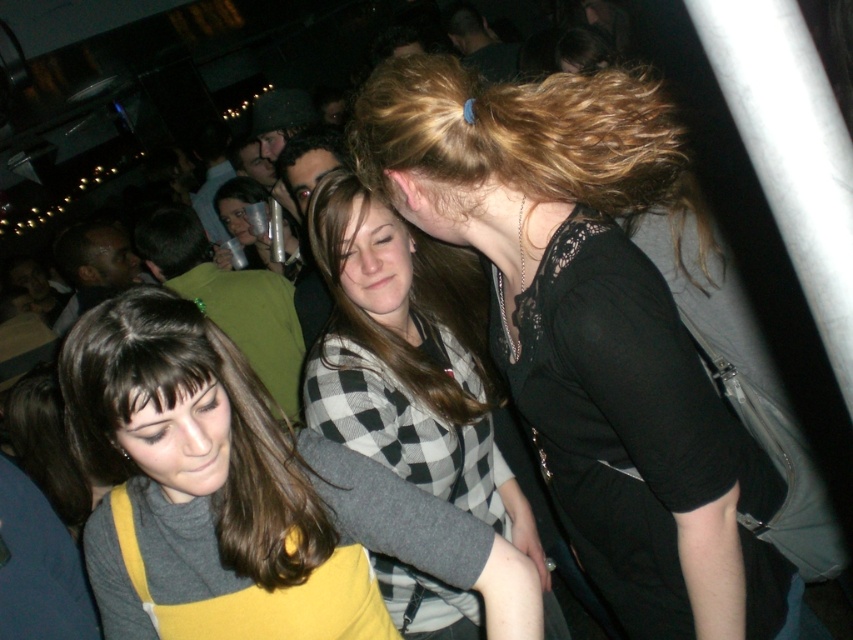
Question: Which point is closer to the camera?

Choices:
 (A) matte yellow dress at center
 (B) checkered fabric sweater at center
 (C) black lace dress at center
 (D) brownsmoothhair at center

Answer: (A)

Question: Estimate the real-world distances between objects in this image. Which object is closer to the matte yellow dress at center?

Choices:
 (A) black lace dress at center
 (B) brownsmoothhair at center
 (C) checkered fabric sweater at center

Answer: (A)

Question: Which object appears farthest from the camera in this image?

Choices:
 (A) black lace dress at center
 (B) checkered fabric sweater at center

Answer: (B)

Question: Is black lace dress at center above matte yellow dress at center?

Choices:
 (A) yes
 (B) no

Answer: (A)

Question: Can you confirm if matte yellow dress at center is smaller than brownsmoothhair at center?

Choices:
 (A) no
 (B) yes

Answer: (A)

Question: Does matte yellow dress at center lie behind brownsmoothhair at center?

Choices:
 (A) yes
 (B) no

Answer: (B)